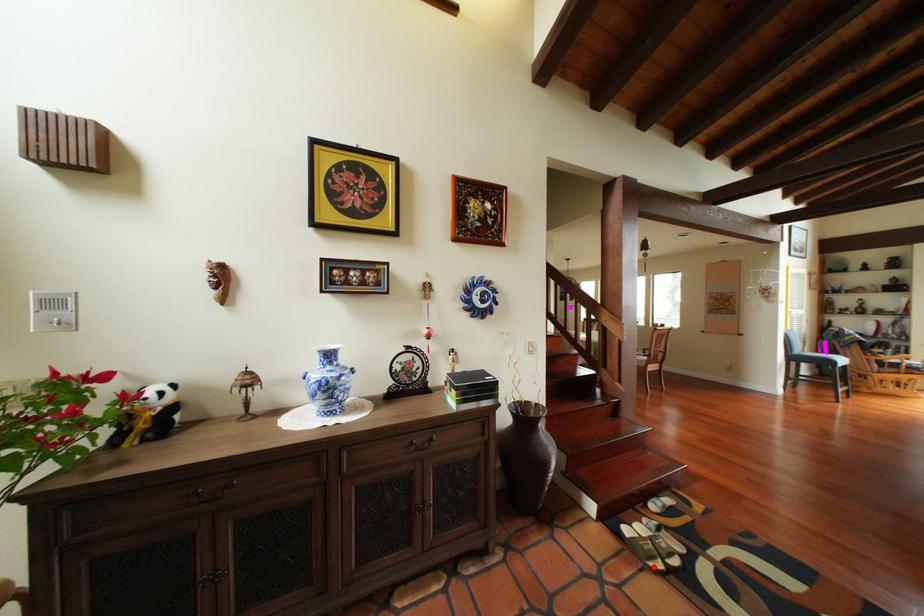
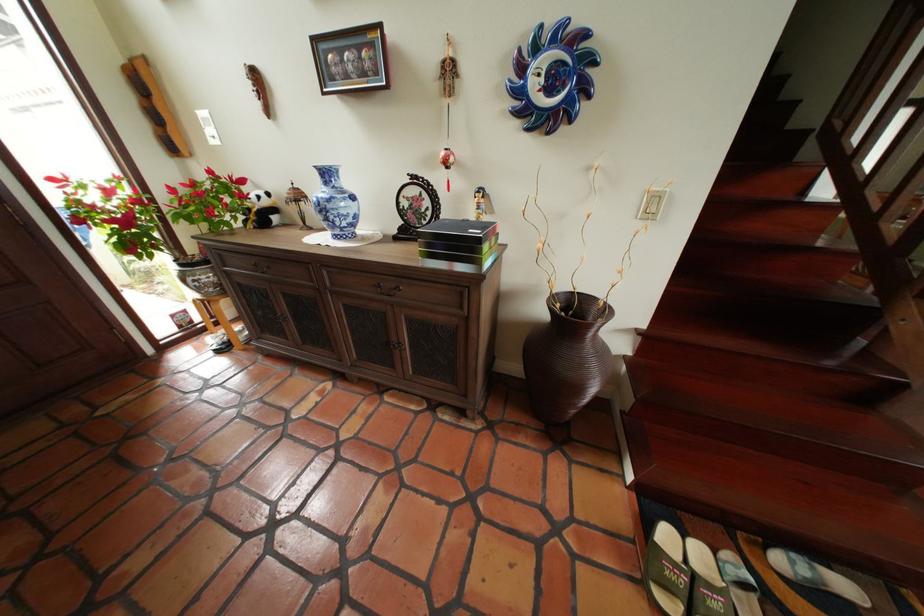
Question: I am providing you with two images of the same scene from different viewpoints. A red point is shown in image1. For the corresponding object point in image2, is it positioned nearer or farther from the camera?

Choices:
 (A) Nearer
 (B) Farther

Answer: (B)